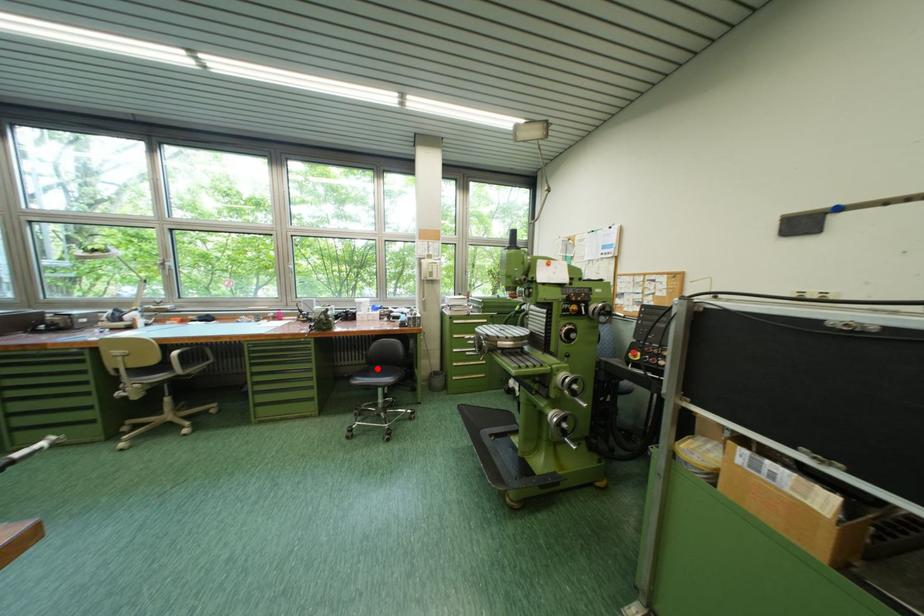
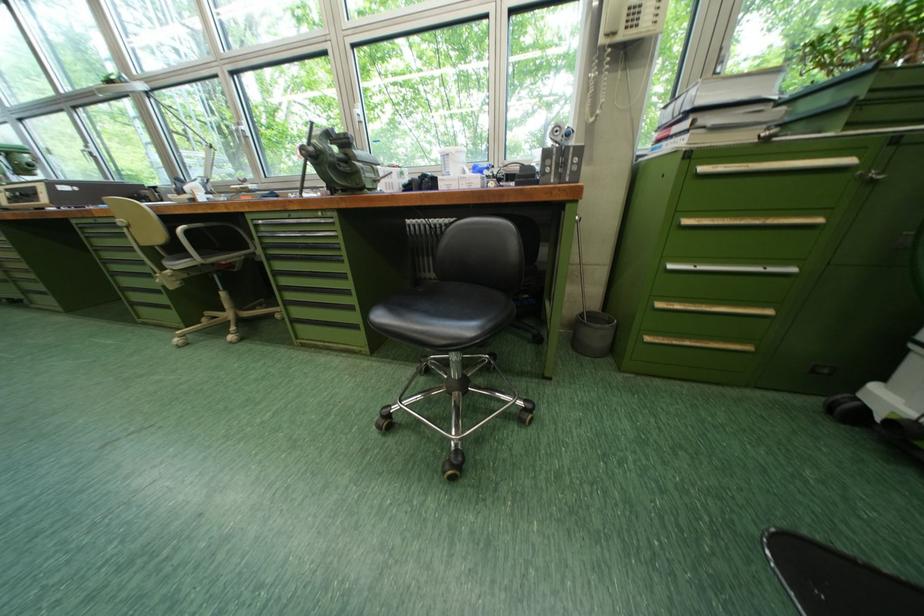
Question: I am providing you with two images of the same scene from different viewpoints. Given a red point in image1, look at the same physical point in image2. Is it:

Choices:
 (A) Closer to the viewpoint
 (B) Farther from the viewpoint

Answer: (A)